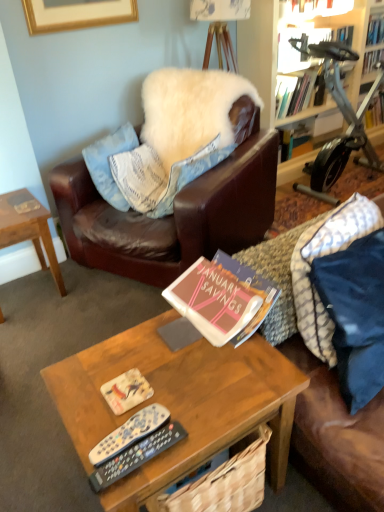
I want to click on free location above matte pink book at center, positioned as the first book in bottom-to-top order (from a real-world perspective), so click(x=231, y=279).